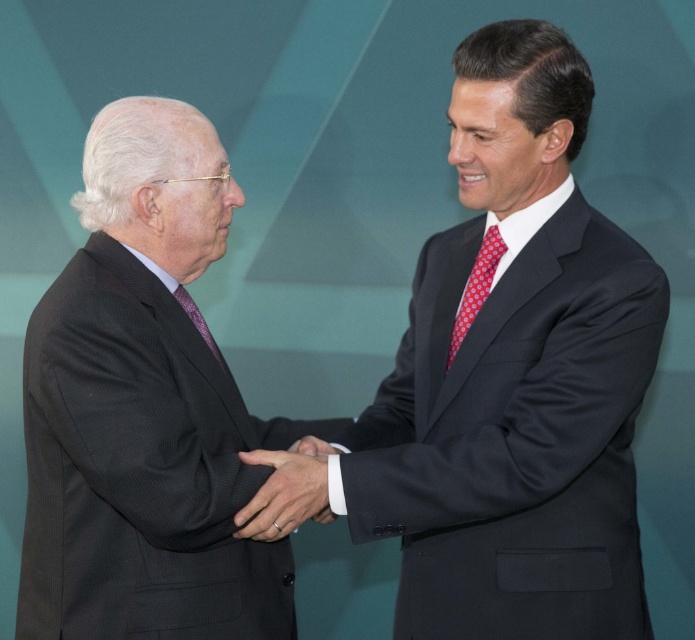
Who is positioned more to the left, dark suit at right or dark gray suit at left?

From the viewer's perspective, dark gray suit at left appears more on the left side.

Where is `dark suit at right`? The image size is (695, 640). dark suit at right is located at coordinates (514, 378).

Where is `dark suit at right`? This screenshot has height=640, width=695. dark suit at right is located at coordinates (514, 378).

Between point (455, 451) and point (270, 518), which one is positioned behind?

Point (270, 518)

Who is taller, dark suit at right or matte black suit at center?

With more height is dark suit at right.

Who is more distant from viewer, (398, 355) or (252, 460)?

The point (398, 355) is more distant.

The height and width of the screenshot is (640, 695). In order to click on dark suit at right in this screenshot , I will do `click(514, 378)`.

Who is shorter, matte black suit at center or red dotted tie at right?

matte black suit at center

Looking at this image, is matte black suit at center taller than red dotted tie at right?

No.

Identify the location of matte black suit at center. The width and height of the screenshot is (695, 640). (286, 490).

Find the location of a particular element. This screenshot has height=640, width=695. matte black suit at center is located at coordinates (286, 490).